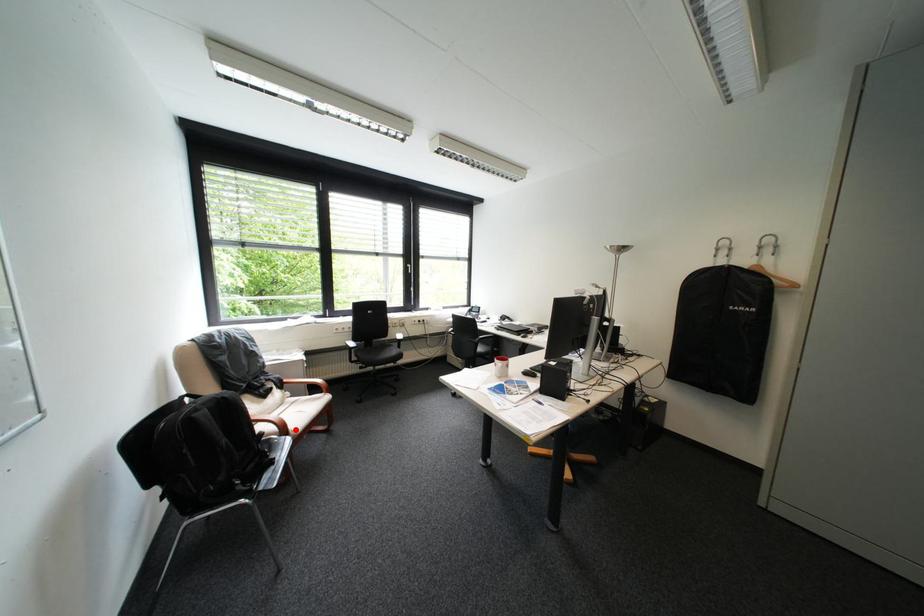
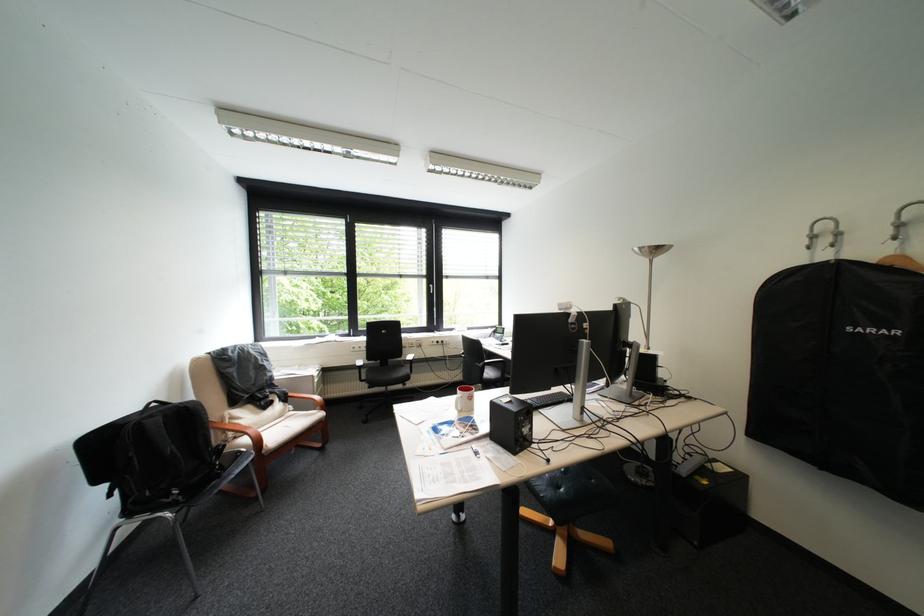
Question: I am providing you with two images of the same scene from different viewpoints. Image1 has a red point marked. In image2, the corresponding 3D location appears at what relative position? Reply with the corresponding letter.

Choices:
 (A) Closer
 (B) Farther

Answer: (B)